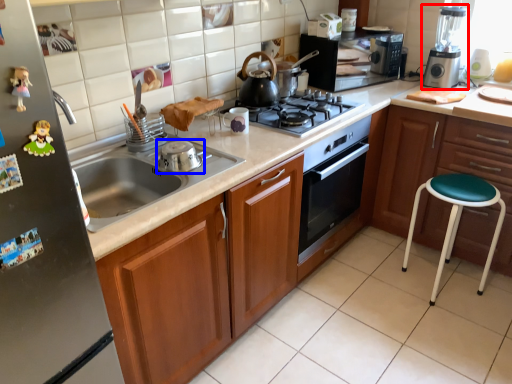
Question: Which point is closer to the camera, kitchen appliance (highlighted by a red box) or appliance (highlighted by a blue box)?

Choices:
 (A) kitchen appliance
 (B) appliance

Answer: (B)